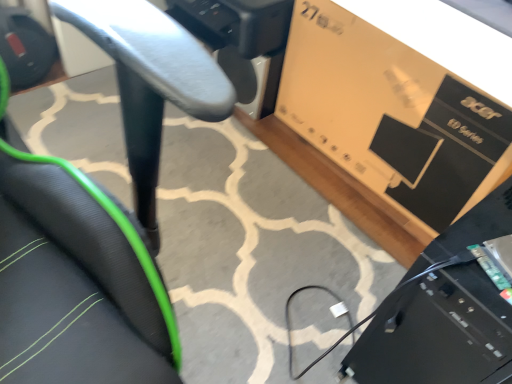
Question: In terms of width, does black plastic computer at lower right look wider or thinner when compared to matte brown cardboard box at upper right?

Choices:
 (A) thin
 (B) wide

Answer: (B)

Question: From their relative heights in the image, would you say black plastic computer at lower right is taller or shorter than matte brown cardboard box at upper right?

Choices:
 (A) short
 (B) tall

Answer: (B)

Question: Estimate the real-world distances between objects in this image. Which object is closer to the black plastic computer at lower right?

Choices:
 (A) black mesh chair at center
 (B) matte brown cardboard box at upper right

Answer: (A)

Question: Which object is positioned farthest from the black plastic computer at lower right?

Choices:
 (A) matte brown cardboard box at upper right
 (B) black mesh chair at center

Answer: (A)